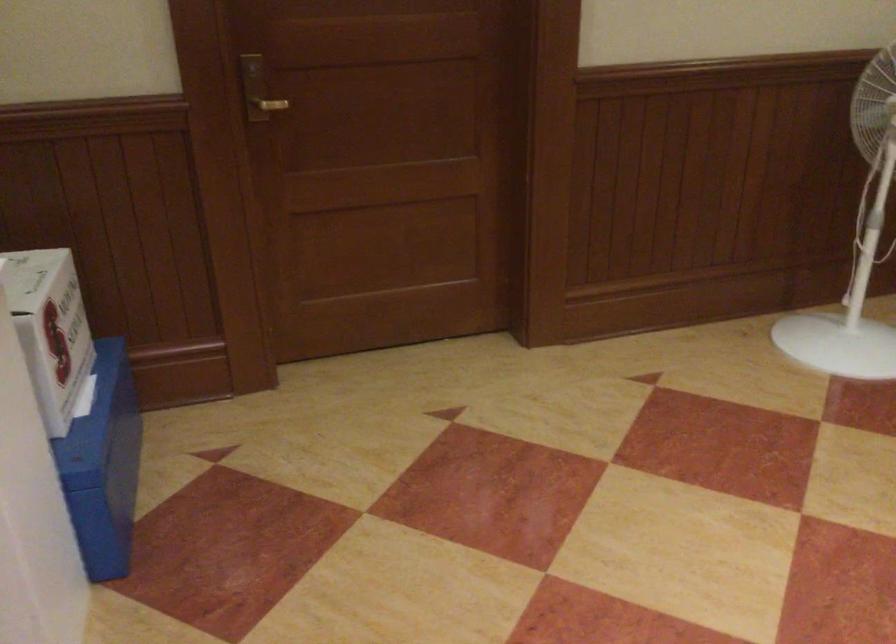
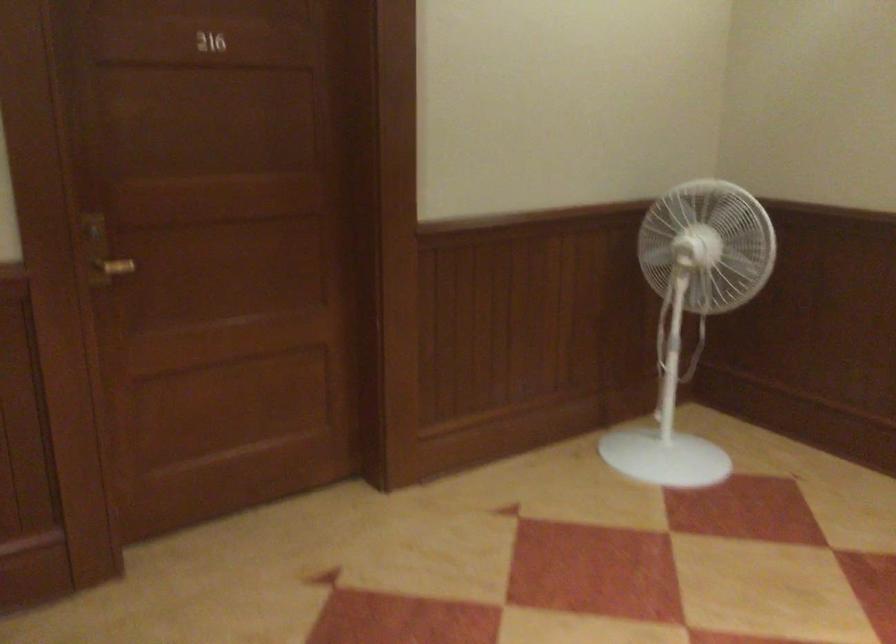
Question: The camera is either moving clockwise (left) or counter-clockwise (right) around the object. The first image is from the beginning of the video and the second image is from the end. Is the camera moving left or right when shooting the video?

Choices:
 (A) Left
 (B) Right

Answer: (A)